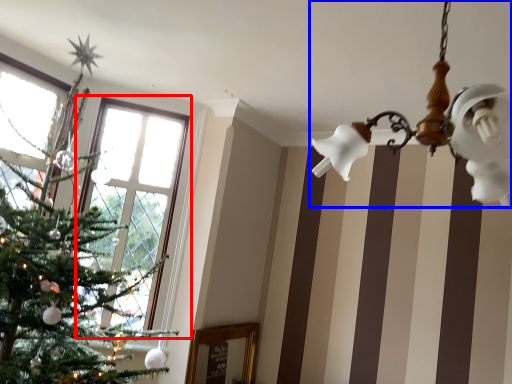
Question: Which object is closer to the camera taking this photo, window (highlighted by a red box) or light fixture (highlighted by a blue box)?

Choices:
 (A) window
 (B) light fixture

Answer: (B)